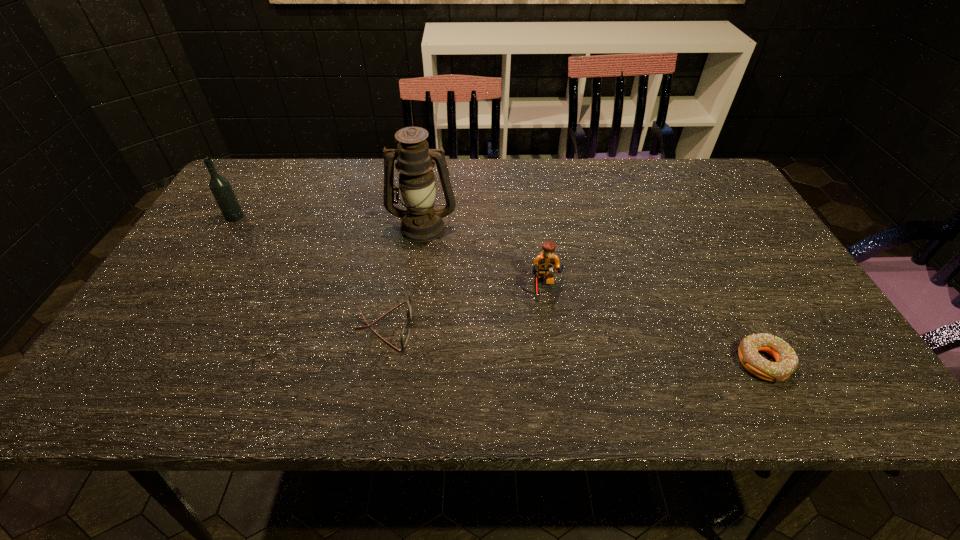
Find the location of a particular element. The image size is (960, 540). the tallest object is located at coordinates (421, 221).

This screenshot has width=960, height=540. Identify the location of the leftmost object. (220, 187).

The height and width of the screenshot is (540, 960). What are the coordinates of `the fourth shortest object` in the screenshot? It's located at (220, 187).

Locate an element on the screen. The height and width of the screenshot is (540, 960). the fourth object from left to right is located at coordinates (545, 263).

I want to click on Lego, so click(545, 263).

This screenshot has height=540, width=960. Identify the location of spectacles. (405, 334).

This screenshot has width=960, height=540. I want to click on the rightmost object, so click(786, 363).

Find the location of `free space located on the right of the oil lamp`. free space located on the right of the oil lamp is located at coordinates (603, 226).

Image resolution: width=960 pixels, height=540 pixels. I want to click on free space located on the back of the leftmost object, so click(x=245, y=201).

Locate an element on the screen. vacant space positioned holding a crossbow in the hands of the Lego is located at coordinates (546, 324).